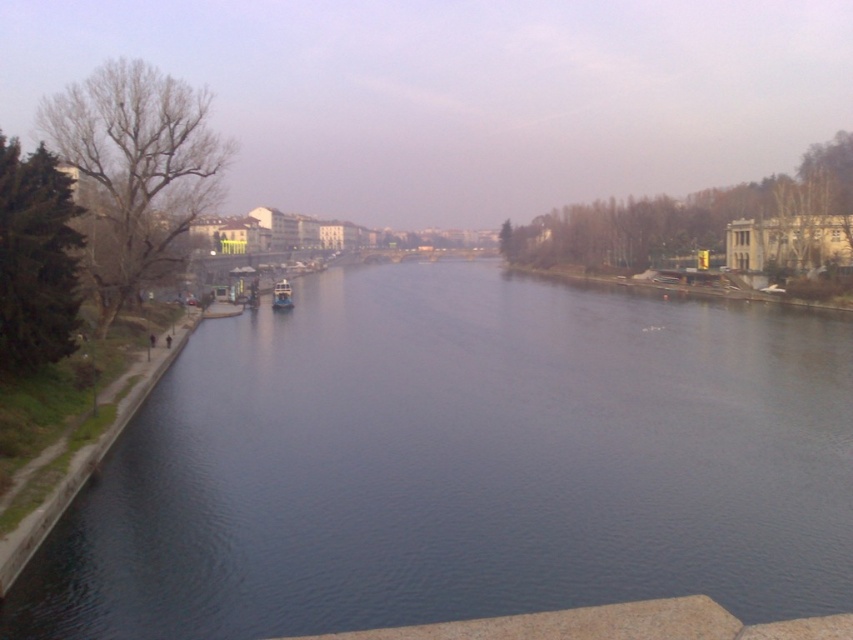
Based on the photo, how distant is dark blue water at center from blue metallic boat at center?

The distance of dark blue water at center from blue metallic boat at center is 118.99 feet.

Can you confirm if dark blue water at center is taller than blue metallic boat at center?

Indeed, dark blue water at center has a greater height compared to blue metallic boat at center.

Which is in front, point (126, 444) or point (283, 294)?

Point (126, 444)

Find the location of `dark blue water at center`. dark blue water at center is located at coordinates (461, 465).